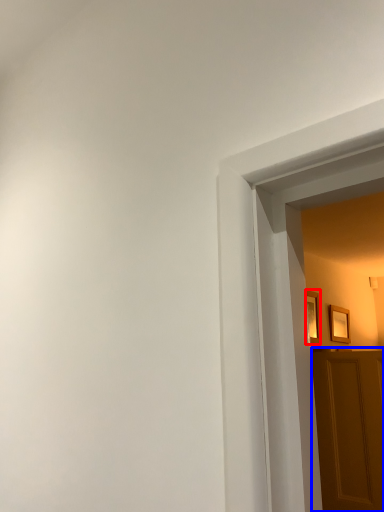
Question: Among these objects, which one is farthest to the camera, picture frame (highlighted by a red box) or door (highlighted by a blue box)?

Choices:
 (A) picture frame
 (B) door

Answer: (A)